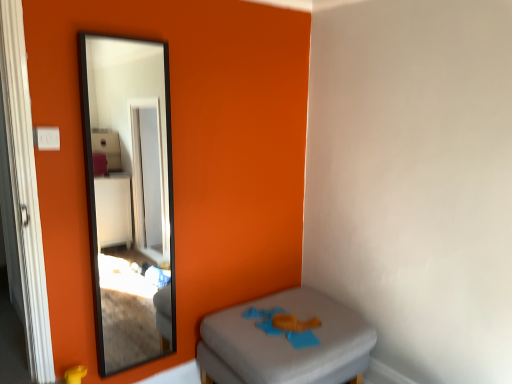
At what (x,y) coordinates should I click in order to perform the action: click on blank space situated above gray fabric ottoman at lower right (from a real-world perspective). Please return your answer as a coordinate pair (x, y). This screenshot has width=512, height=384. Looking at the image, I should click on (270, 318).